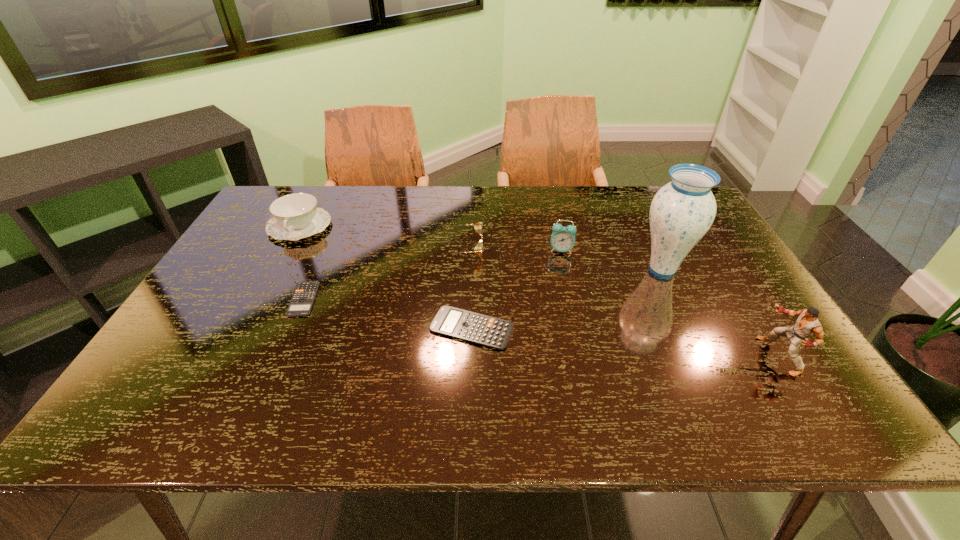
Identify the location of the shorter calculator. The height and width of the screenshot is (540, 960). (301, 303).

I want to click on the shortest object, so click(x=301, y=303).

Where is `the right calculator`? This screenshot has width=960, height=540. the right calculator is located at coordinates coord(485,330).

I want to click on the sixth tallest object, so tap(485, 330).

Locate an element on the screen. This screenshot has width=960, height=540. sunglasses is located at coordinates (477, 250).

Locate an element on the screen. chinaware is located at coordinates [x=295, y=216].

This screenshot has width=960, height=540. I want to click on the sixth object from left to right, so click(682, 211).

You are a GUI agent. You are given a task and a screenshot of the screen. Output one action in this format:
    pyautogui.click(x=<x>, y=<y>)
    Task: Click on the vase
    This screenshot has height=540, width=960.
    Given the screenshot: What is the action you would take?
    pyautogui.click(x=682, y=211)

Where is `the third object from right to left`? the third object from right to left is located at coordinates (563, 238).

You are a GUI agent. You are given a task and a screenshot of the screen. Output one action in this format:
    pyautogui.click(x=<x>, y=<y>)
    Task: Click on the fifth shortest object
    
    Given the screenshot: What is the action you would take?
    pyautogui.click(x=563, y=238)